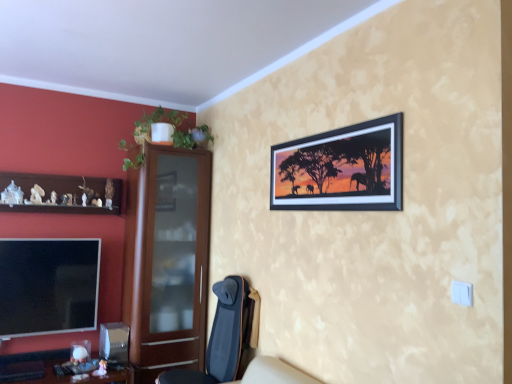
Question: Do you think flat screen tv at lower left is within brushed wood desk at lower left, or outside of it?

Choices:
 (A) outside
 (B) inside

Answer: (A)

Question: Does point (42, 251) appear closer or farther from the camera than point (40, 350)?

Choices:
 (A) closer
 (B) farther

Answer: (A)

Question: Which of these objects is positioned closest to the brown wooden dresser at left?

Choices:
 (A) dark blue fabric chair at lower center
 (B) flat screen tv at lower left
 (C) brown wooden shelf at left
 (D) brushed wood desk at lower left
 (E) green leafy plant at upper left

Answer: (A)

Question: Based on their relative distances, which object is farther from the flat screen tv at lower left?

Choices:
 (A) brown wooden shelf at left
 (B) brushed wood desk at lower left
 (C) brown wooden dresser at left
 (D) dark blue fabric chair at lower center
 (E) green leafy plant at upper left

Answer: (D)